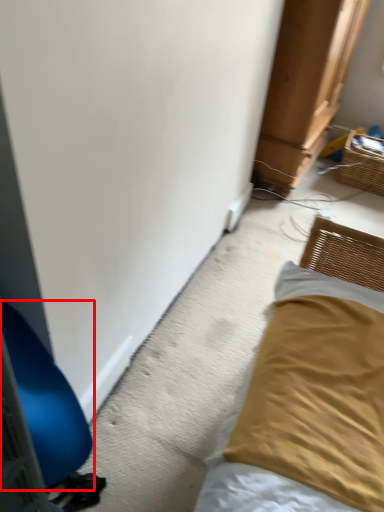
Question: In this image, where is furniture (annotated by the red box) located relative to basket?

Choices:
 (A) left
 (B) right

Answer: (A)